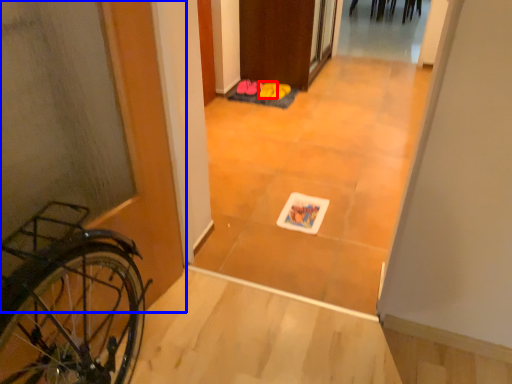
Question: Which object appears farthest to the camera in this image, footwear (highlighted by a red box) or door (highlighted by a blue box)?

Choices:
 (A) footwear
 (B) door

Answer: (A)